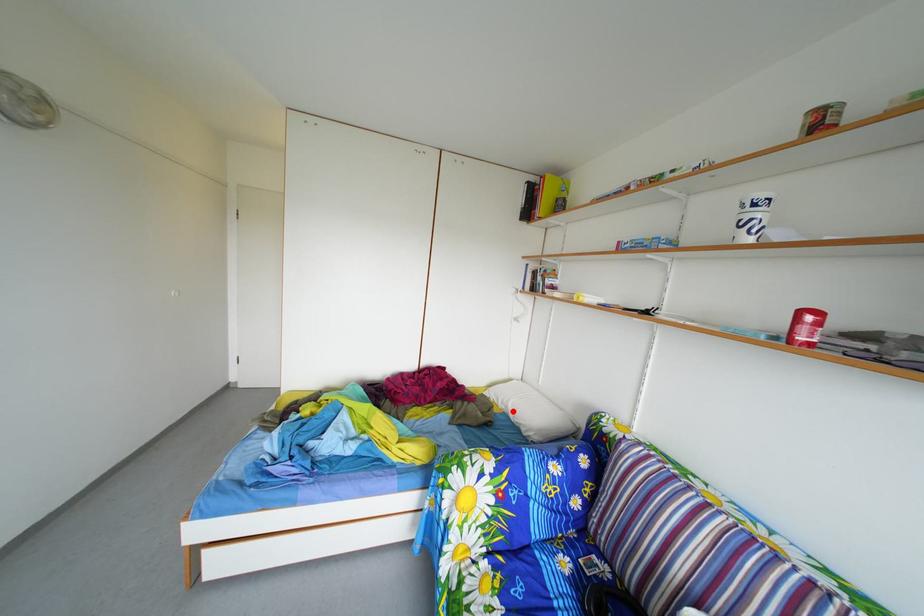
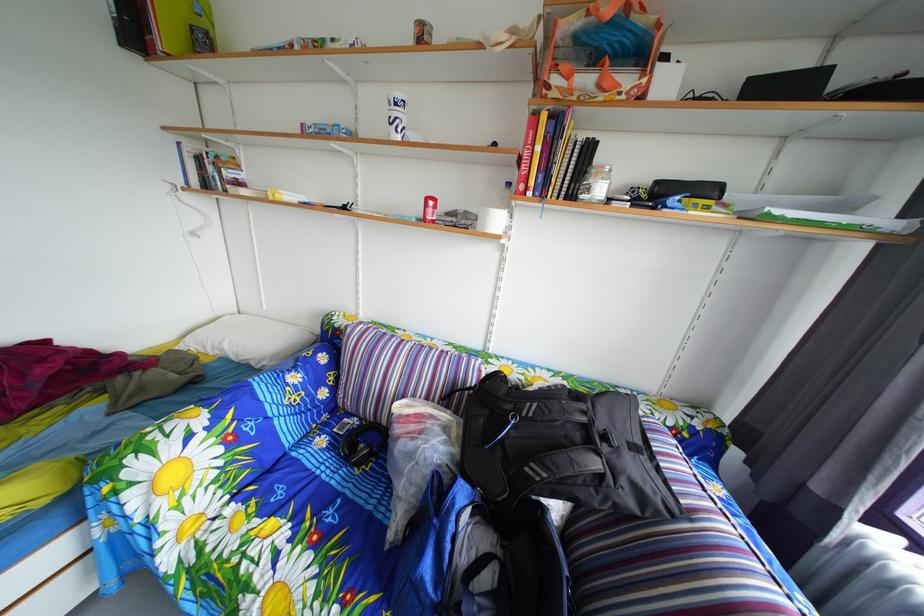
Locate, in the second image, the point that corresponds to the highlighted location in the first image.

(224, 357)